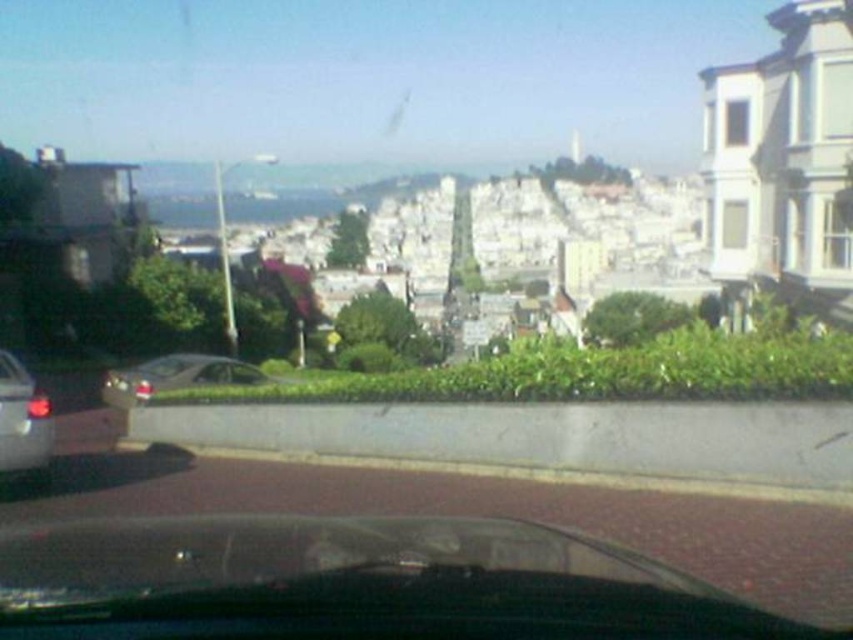
You are driving a car and need to parallel park between two cars. There is a satin silver sedan at center. Based on its position, can you estimate the available space for your car?

The satin silver sedan at center is located at point (177, 376), which indicates it is positioned centrally in the frame. This suggests there is sufficient space on either side of it for your car to maneuver into a parking spot.

You are driving a satin silver sedan at center and need to parallel park between two cars. The shiny silver car at left is already parked. Considering their widths, which car should you position closer to when aligning your vehicle for parking?

Since the satin silver sedan at center is wider than the shiny silver car at left, you should position closer to the shiny silver car at left to ensure proper alignment and avoid overhanging into the road.

You are driving a car and want to park in the spot where the shiny silver car at left is currently parked. The parking spot is only wide enough for one car. Can you safely maneuver your car into that spot without hitting the satin silver sedan at center?

The satin silver sedan at center is to the left of the shiny silver car at left, meaning it is positioned closer to the parking spot. Since the parking spot is only wide enough for one car, you cannot safely maneuver your car into that spot without hitting the satin silver sedan at center.